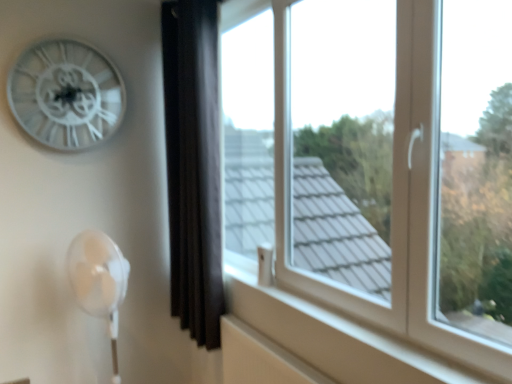
Question: Is transparent glass window at center smaller than white metallic clock at upper left?

Choices:
 (A) no
 (B) yes

Answer: (A)

Question: Is white metallic clock at upper left at the back of transparent glass window at center?

Choices:
 (A) no
 (B) yes

Answer: (A)

Question: From the image's perspective, would you say transparent glass window at center is shown under white metallic clock at upper left?

Choices:
 (A) no
 (B) yes

Answer: (B)

Question: Does transparent glass window at center turn towards white metallic clock at upper left?

Choices:
 (A) no
 (B) yes

Answer: (B)

Question: Is white metallic clock at upper left located within transparent glass window at center?

Choices:
 (A) yes
 (B) no

Answer: (B)

Question: In terms of size, does transparent glass window at center appear bigger or smaller than white metallic clock at upper left?

Choices:
 (A) big
 (B) small

Answer: (A)

Question: In the image, is transparent glass window at center positioned in front of or behind white metallic clock at upper left?

Choices:
 (A) behind
 (B) front

Answer: (B)

Question: In the image, is transparent glass window at center on the left side or the right side of white metallic clock at upper left?

Choices:
 (A) right
 (B) left

Answer: (A)

Question: Is transparent glass window at center inside the boundaries of white metallic clock at upper left, or outside?

Choices:
 (A) outside
 (B) inside

Answer: (A)

Question: Considering the relative positions of black velvet curtain at center and white metallic clock at upper left in the image provided, is black velvet curtain at center to the left or to the right of white metallic clock at upper left?

Choices:
 (A) left
 (B) right

Answer: (B)

Question: In terms of width, does black velvet curtain at center look wider or thinner when compared to white metallic clock at upper left?

Choices:
 (A) thin
 (B) wide

Answer: (B)

Question: Is point 212,137 closer or farther from the camera than point 96,135?

Choices:
 (A) closer
 (B) farther

Answer: (A)

Question: Is black velvet curtain at center taller or shorter than white metallic clock at upper left?

Choices:
 (A) tall
 (B) short

Answer: (A)

Question: Is transparent glass window at center bigger or smaller than black velvet curtain at center?

Choices:
 (A) small
 (B) big

Answer: (B)

Question: From their relative heights in the image, would you say transparent glass window at center is taller or shorter than black velvet curtain at center?

Choices:
 (A) tall
 (B) short

Answer: (B)